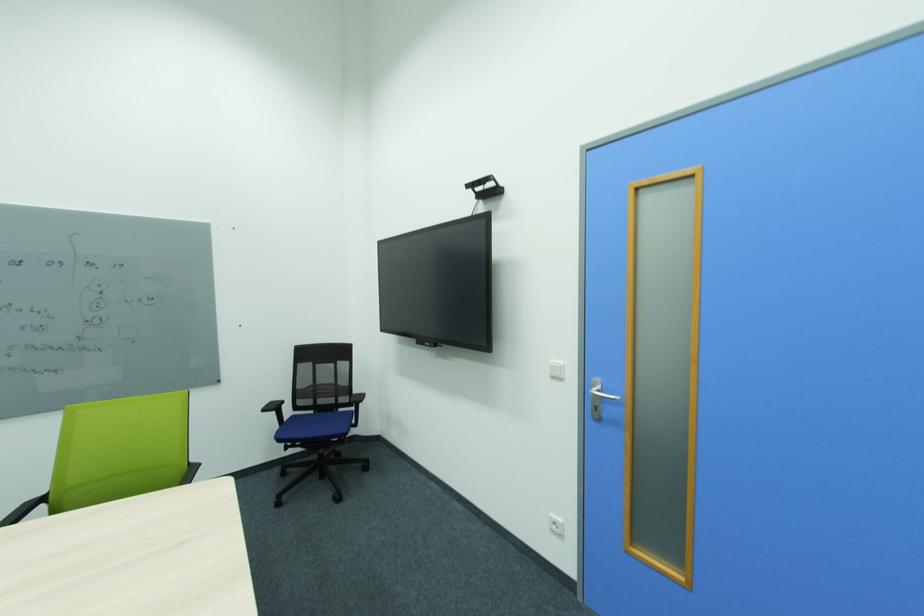
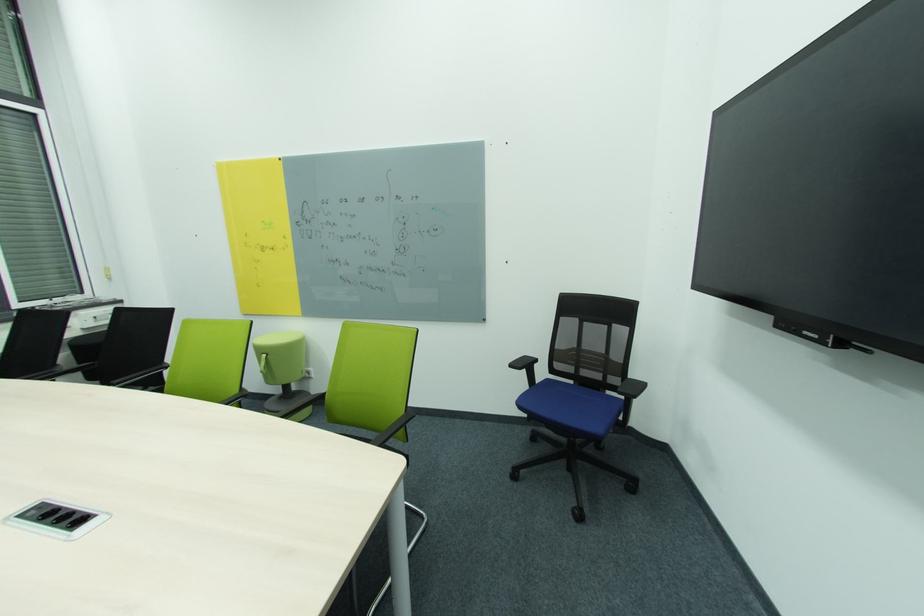
Question: The camera is either moving clockwise (left) or counter-clockwise (right) around the object. The first image is from the beginning of the video and the second image is from the end. Is the camera moving left or right when shooting the video?

Choices:
 (A) Left
 (B) Right

Answer: (B)